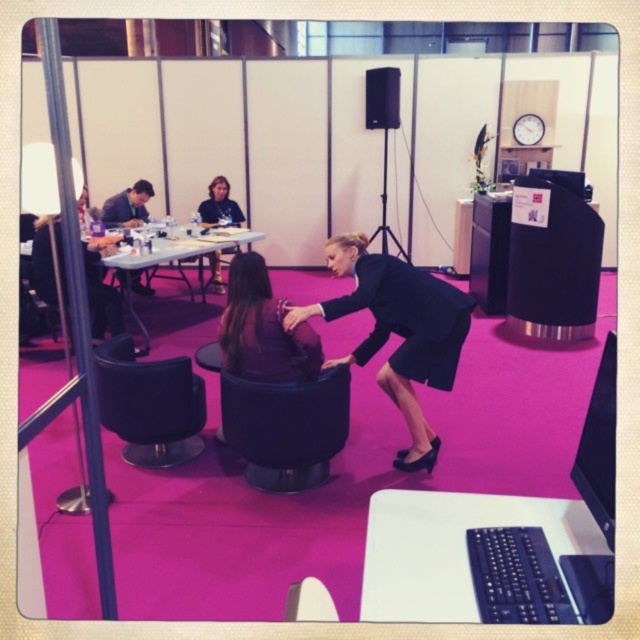
Find the location of a particular element. Image resolution: width=640 pixels, height=640 pixels. black leather armchair at center is located at coordinates (285, 428).

Does black leather armchair at center have a greater width compared to black matte speaker at upper center?

Yes, black leather armchair at center is wider than black matte speaker at upper center.

Who is more forward, (259, 445) or (394, 122)?

Point (259, 445) is more forward.

Locate an element on the screen. This screenshot has height=640, width=640. black leather armchair at center is located at coordinates (285, 428).

Who is more distant from viewer, (x=184, y=356) or (x=140, y=330)?

Point (x=140, y=330)

Who is positioned more to the right, black leather chair at center or white plastic table at center?

black leather chair at center

Locate an element on the screen. black leather chair at center is located at coordinates (148, 404).

Is the position of white plastic round table at center less distant than that of white plastic table at center?

Yes, white plastic round table at center is closer to the viewer.

Identify the location of white plastic round table at center. (451, 547).